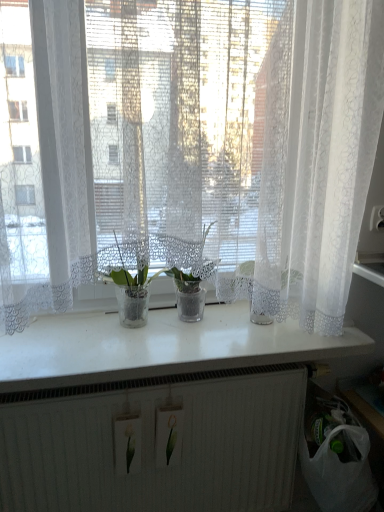
At what (x,y) coordinates should I click in order to perform the action: click on spots to the right of translucent glass pot at center, the first houseplant from the right. Please return your answer as a coordinate pair (x, y). The height and width of the screenshot is (512, 384). Looking at the image, I should click on (240, 324).